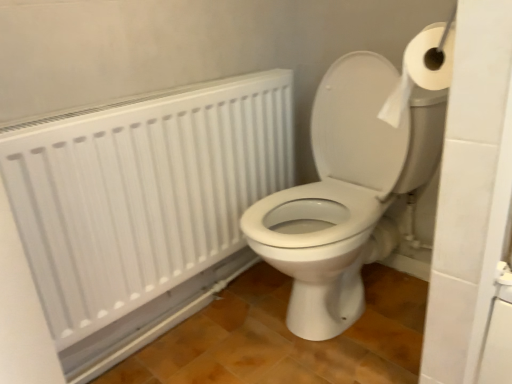
Question: Does white glossy toilet at center appear on the right side of white matte radiator at upper left?

Choices:
 (A) yes
 (B) no

Answer: (A)

Question: Can we say white glossy toilet at center lies outside white matte radiator at upper left?

Choices:
 (A) yes
 (B) no

Answer: (A)

Question: Can you confirm if white glossy toilet at center is shorter than white matte radiator at upper left?

Choices:
 (A) no
 (B) yes

Answer: (A)

Question: From a real-world perspective, is white glossy toilet at center located higher than white matte radiator at upper left?

Choices:
 (A) no
 (B) yes

Answer: (A)

Question: Is white glossy toilet at center thinner than white matte radiator at upper left?

Choices:
 (A) yes
 (B) no

Answer: (B)

Question: Considering the relative sizes of white glossy toilet at center and white matte radiator at upper left in the image provided, is white glossy toilet at center bigger than white matte radiator at upper left?

Choices:
 (A) yes
 (B) no

Answer: (A)

Question: Is the depth of white glossy toilet at center greater than that of white paper at upper right?

Choices:
 (A) yes
 (B) no

Answer: (A)

Question: From the image's perspective, is white glossy toilet at center located above white paper at upper right?

Choices:
 (A) yes
 (B) no

Answer: (B)

Question: Could you tell me if white glossy toilet at center is turned towards white paper at upper right?

Choices:
 (A) no
 (B) yes

Answer: (A)

Question: Does white glossy toilet at center have a lesser height compared to white paper at upper right?

Choices:
 (A) no
 (B) yes

Answer: (A)

Question: Would you say white glossy toilet at center is outside white paper at upper right?

Choices:
 (A) no
 (B) yes

Answer: (B)

Question: Is white glossy toilet at center not close to white paper at upper right?

Choices:
 (A) no
 (B) yes

Answer: (A)

Question: Could you tell me if white matte radiator at upper left is turned towards white paper at upper right?

Choices:
 (A) yes
 (B) no

Answer: (A)